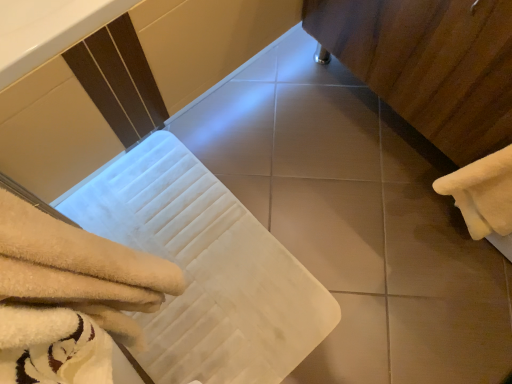
Question: Considering the relative positions of white fluffy towel at right, the 2th towel positioned from the left, and white fluffy towel at lower left, arranged as the first towel when viewed from the left, in the image provided, is white fluffy towel at right, the 2th towel positioned from the left, to the right of white fluffy towel at lower left, arranged as the first towel when viewed from the left, from the viewer's perspective?

Choices:
 (A) no
 (B) yes

Answer: (B)

Question: Can we say white fluffy towel at right, which ranks as the first towel in right-to-left order, lies outside white fluffy towel at lower left, arranged as the second towel when viewed from the right?

Choices:
 (A) no
 (B) yes

Answer: (B)

Question: Is white fluffy towel at right, the 2th towel positioned from the left, wider than white fluffy towel at lower left, arranged as the second towel when viewed from the right?

Choices:
 (A) no
 (B) yes

Answer: (A)

Question: Is white fluffy towel at lower left, arranged as the first towel when viewed from the left, at the back of white fluffy towel at right, which ranks as the first towel in right-to-left order?

Choices:
 (A) no
 (B) yes

Answer: (A)

Question: From the image's perspective, is white fluffy towel at right, the 2th towel positioned from the left, above white fluffy towel at lower left, arranged as the second towel when viewed from the right?

Choices:
 (A) yes
 (B) no

Answer: (A)

Question: Can you confirm if white fluffy towel at right, the 2th towel positioned from the left, is thinner than white fluffy towel at lower left, arranged as the second towel when viewed from the right?

Choices:
 (A) yes
 (B) no

Answer: (A)

Question: Considering the relative sizes of smooth beige tile at center and wooden cabinet at right in the image provided, is smooth beige tile at center bigger than wooden cabinet at right?

Choices:
 (A) no
 (B) yes

Answer: (A)

Question: Is the position of smooth beige tile at center more distant than that of wooden cabinet at right?

Choices:
 (A) yes
 (B) no

Answer: (A)

Question: Is smooth beige tile at center smaller than wooden cabinet at right?

Choices:
 (A) no
 (B) yes

Answer: (B)

Question: From a real-world perspective, does smooth beige tile at center sit lower than wooden cabinet at right?

Choices:
 (A) yes
 (B) no

Answer: (A)

Question: Is smooth beige tile at center not within wooden cabinet at right?

Choices:
 (A) yes
 (B) no

Answer: (A)

Question: Is smooth beige tile at center facing away from wooden cabinet at right?

Choices:
 (A) no
 (B) yes

Answer: (A)

Question: From the image's perspective, is white fluffy towel at lower left, arranged as the first towel when viewed from the left, beneath wooden cabinet at right?

Choices:
 (A) yes
 (B) no

Answer: (A)